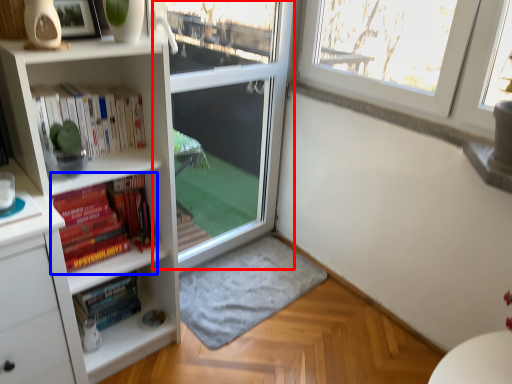
Question: Which of the following is the farthest to the observer, screen door (highlighted by a red box) or book (highlighted by a blue box)?

Choices:
 (A) screen door
 (B) book

Answer: (A)